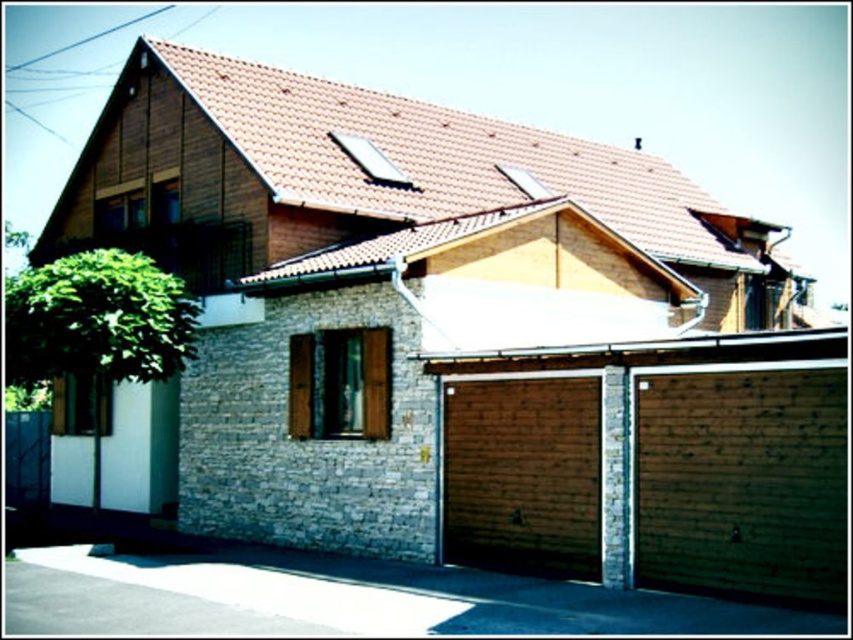
From the picture: You are standing in front of the two story residential building and see the wooden garage door at lower right and the wooden at lower center. Which one is closer to you?

The wooden garage door at lower right is closer to you because it is in front of the wooden at lower center.

You are standing at the entrance of the residential building and want to park your car. Where is the wooden garage door at lower right located relative to your position?

The wooden garage door at lower right is located at point [654,464] relative to your position, which is to the lower right side of the building.

You are a delivery person trying to park your truck next to the wooden garage door at lower right and the wooden at lower center. Which of these two wooden structures has a wider width to accommodate the truck?

The wooden at lower center is wider than the wooden garage door at lower right, so the truck can be parked next to the wooden at lower center.